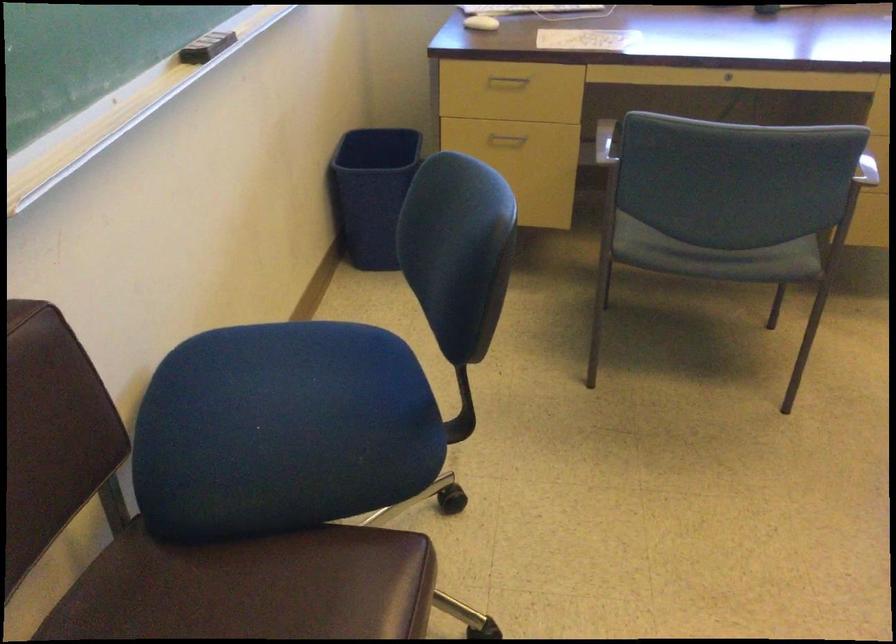
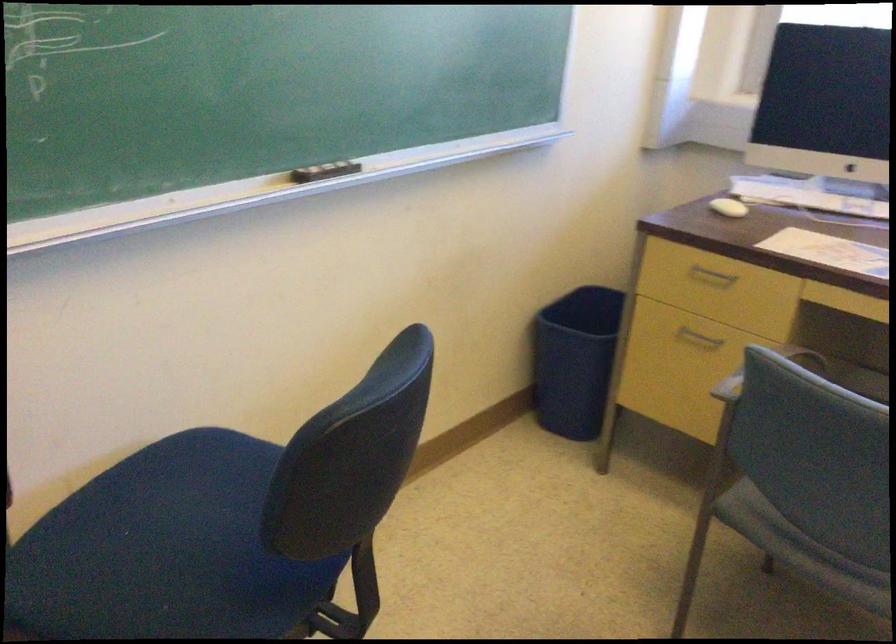
In the second image, find the point that corresponds to (297,433) in the first image.

(165, 550)